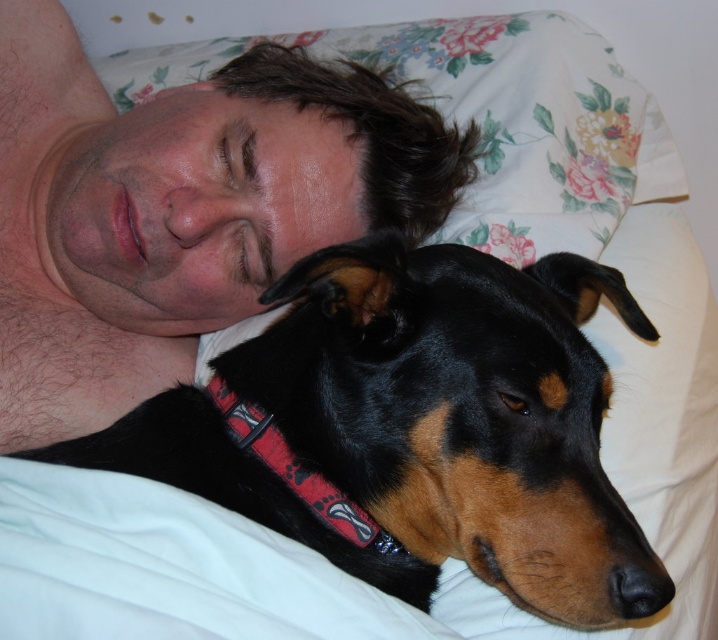
Based on the scene, which object is taller between the black shiny dog at center and the hairless skin at upper center?

The hairless skin at upper center is taller than the black shiny dog at center.

You are a photographer trying to capture a candid shot of the black shiny dog at center and the hairless skin at upper center in the scene. If you want to ensure both subjects are fully visible in the frame, which subject should you focus on to avoid cropping either?

Since the black shiny dog at center occupies less space than hairless skin at upper center, you should focus on the hairless skin at upper center to ensure the larger subject fits without cropping.